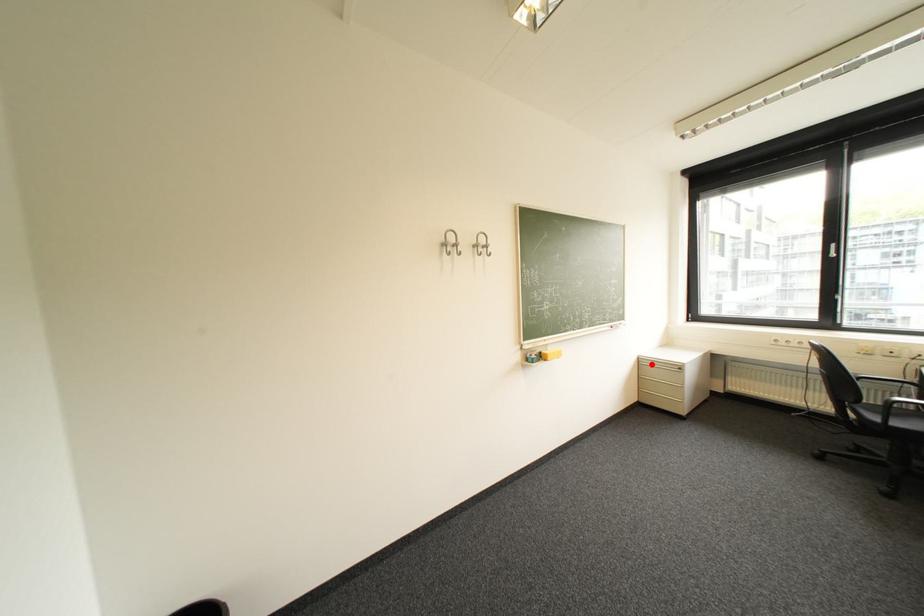
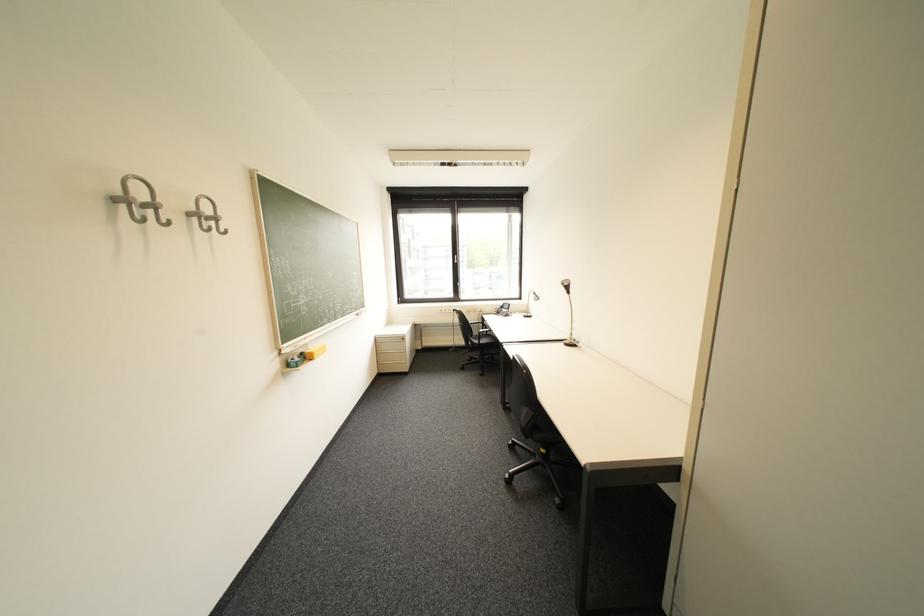
Question: I am providing you with two images of the same scene from different viewpoints. A red point is marked on the first image. Is the red point's position out of view in image 2?

Choices:
 (A) Yes
 (B) No

Answer: (B)